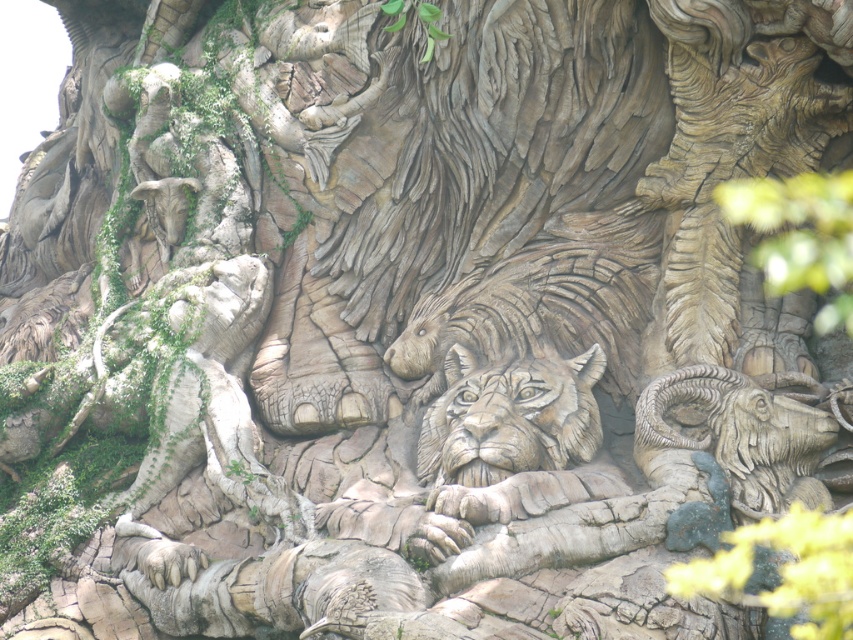
Does point (759, 433) come farther from viewer compared to point (488, 442)?

That is False.

Which is behind, point (793, 406) or point (463, 413)?

Positioned behind is point (463, 413).

Identify the location of carved stone ram at center. pos(733,435).

Who is lower down, wooden lion face at center or wooden carving of bird at upper left?

wooden lion face at center is below.

The width and height of the screenshot is (853, 640). What do you see at coordinates (503, 420) in the screenshot? I see `wooden lion face at center` at bounding box center [503, 420].

Where is `wooden lion face at center`? wooden lion face at center is located at coordinates (503, 420).

From the picture: Who is taller, carved stone lion at center or carved stone ram at center?

With more height is carved stone lion at center.

Find the location of a particular element. carved stone lion at center is located at coordinates (509, 417).

In order to click on carved stone lion at center in this screenshot , I will do `click(509, 417)`.